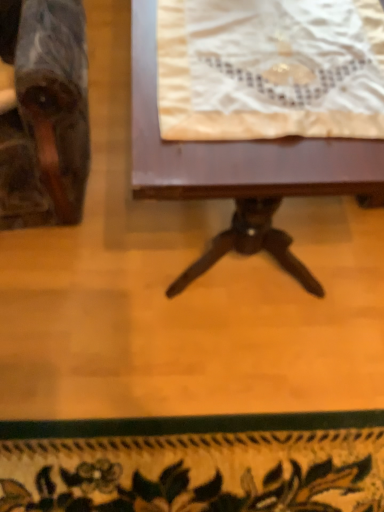
This screenshot has height=512, width=384. What are the coordinates of `vacant area that is in front of marble-like wooden chair at left` in the screenshot? It's located at click(90, 320).